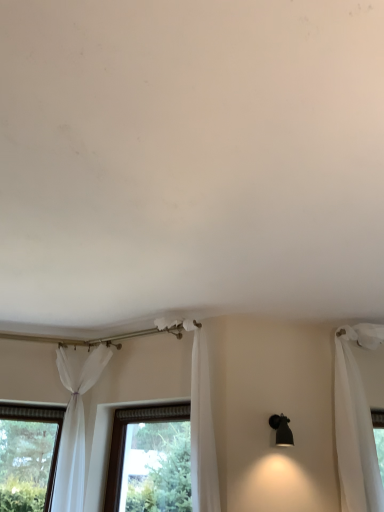
What is the approximate width of sheer white curtain at lower left, which appears as the first curtain when viewed from the left?

sheer white curtain at lower left, which appears as the first curtain when viewed from the left, is 54.36 centimeters wide.

At what (x,y) coordinates should I click in order to perform the action: click on clear glass window at center. Please return your answer as a coordinate pair (x, y). The width and height of the screenshot is (384, 512). Looking at the image, I should click on (125, 439).

Can you see clear glass window at center touching black matte wall sconce at right?

No, clear glass window at center is not next to black matte wall sconce at right.

Is clear glass window at center surrounding black matte wall sconce at right?

That's incorrect, black matte wall sconce at right is not inside clear glass window at center.

Does clear glass window at center have a lesser height compared to black matte wall sconce at right?

In fact, clear glass window at center may be taller than black matte wall sconce at right.

Which is behind, point (120, 431) or point (289, 443)?

The point (120, 431) is more distant.

Who is taller, black matte wall sconce at right or sheer white curtain at lower left, which appears as the first curtain when viewed from the left?

sheer white curtain at lower left, which appears as the first curtain when viewed from the left.

In the scene shown: Between black matte wall sconce at right and sheer white curtain at lower left, arranged as the 2th curtain when viewed from the right, which one is positioned in front?

black matte wall sconce at right is more forward.

Considering the positions of point (287, 424) and point (86, 361), is point (287, 424) closer or farther from the camera than point (86, 361)?

Clearly, point (287, 424) is closer to the camera than point (86, 361).

From the image's perspective, which object appears higher, black matte wall sconce at right or sheer white curtain at lower left, which appears as the first curtain when viewed from the left?

black matte wall sconce at right is shown above in the image.

Is white sheer curtain at center, positioned as the 1th curtain in right-to-left order, further to camera compared to clear glass window at center?

No.

Between white sheer curtain at center, which is counted as the 2th curtain, starting from the left, and clear glass window at center, which one has smaller width?

With smaller width is clear glass window at center.

Could you tell me if white sheer curtain at center, positioned as the 1th curtain in right-to-left order, is turned towards clear glass window at center?

No, white sheer curtain at center, positioned as the 1th curtain in right-to-left order, is not aimed at clear glass window at center.

From a real-world perspective, who is located higher, white sheer curtain at center, positioned as the 1th curtain in right-to-left order, or clear glass window at center?

From a 3D spatial view, white sheer curtain at center, positioned as the 1th curtain in right-to-left order, is above.

Consider the image. Considering the sizes of clear glass window at center and white sheer curtain at center, positioned as the 1th curtain in right-to-left order, in the image, is clear glass window at center bigger or smaller than white sheer curtain at center, positioned as the 1th curtain in right-to-left order,?

clear glass window at center is smaller than white sheer curtain at center, positioned as the 1th curtain in right-to-left order.

Which is correct: clear glass window at center is inside white sheer curtain at center, positioned as the 1th curtain in right-to-left order, or outside of it?

clear glass window at center is not inside white sheer curtain at center, positioned as the 1th curtain in right-to-left order, it's outside.

Can you tell me how much clear glass window at center and white sheer curtain at center, positioned as the 1th curtain in right-to-left order, differ in facing direction?

There is a 0.000783-degree angle between the facing directions of clear glass window at center and white sheer curtain at center, positioned as the 1th curtain in right-to-left order.

Could you tell me if clear glass window at center is turned towards white sheer curtain at center, which is counted as the 2th curtain, starting from the left?

Yes, clear glass window at center is oriented towards white sheer curtain at center, which is counted as the 2th curtain, starting from the left.

Is black matte wall sconce at right inside the boundaries of white sheer curtain at center, which is counted as the 2th curtain, starting from the left, or outside?

black matte wall sconce at right is not inside white sheer curtain at center, which is counted as the 2th curtain, starting from the left, it's outside.

From the image's perspective, is black matte wall sconce at right beneath white sheer curtain at center, positioned as the 1th curtain in right-to-left order?

Correct, black matte wall sconce at right appears lower than white sheer curtain at center, positioned as the 1th curtain in right-to-left order, in the image.

What's the angular difference between black matte wall sconce at right and white sheer curtain at center, positioned as the 1th curtain in right-to-left order,'s facing directions?

The angular difference between black matte wall sconce at right and white sheer curtain at center, positioned as the 1th curtain in right-to-left order, is 44.6 degrees.

Which is in front, black matte wall sconce at right or white sheer curtain at center, which is counted as the 2th curtain, starting from the left?

white sheer curtain at center, which is counted as the 2th curtain, starting from the left, is closer to the camera.

Can you confirm if black matte wall sconce at right is smaller than clear glass window at center?

Yes.

Is black matte wall sconce at right touching clear glass window at center?

No, black matte wall sconce at right is not in contact with clear glass window at center.

At what (x,y) coordinates should I click in order to perform the action: click on window on the left of black matte wall sconce at right. Please return your answer as a coordinate pair (x, y). Looking at the image, I should click on (125, 439).

From the image's perspective, is white sheer curtain at center, which is counted as the 2th curtain, starting from the left, located above or below black matte wall sconce at right?

white sheer curtain at center, which is counted as the 2th curtain, starting from the left, is situated higher than black matte wall sconce at right in the image.

Is black matte wall sconce at right at the back of white sheer curtain at center, positioned as the 1th curtain in right-to-left order?

No, black matte wall sconce at right is not at the back of white sheer curtain at center, positioned as the 1th curtain in right-to-left order.

Could black matte wall sconce at right be considered to be inside white sheer curtain at center, positioned as the 1th curtain in right-to-left order?

No, black matte wall sconce at right is not surrounded by white sheer curtain at center, positioned as the 1th curtain in right-to-left order.

Who is smaller, white sheer curtain at center, positioned as the 1th curtain in right-to-left order, or black matte wall sconce at right?

Smaller between the two is black matte wall sconce at right.

Find the location of a particular element. window below the black matte wall sconce at right (from a real-world perspective) is located at coordinates (125, 439).

Find the location of a particular element. curtain located behind the black matte wall sconce at right is located at coordinates (75, 423).

Based on their spatial positions, is black matte wall sconce at right or sheer white curtain at lower left, which appears as the first curtain when viewed from the left, closer to clear glass window at center?

sheer white curtain at lower left, which appears as the first curtain when viewed from the left, is positioned closer to the anchor clear glass window at center.

From the image, which object appears to be nearer to sheer white curtain at lower left, arranged as the 2th curtain when viewed from the right, black matte wall sconce at right or clear glass window at center?

Among the two, clear glass window at center is located nearer to sheer white curtain at lower left, arranged as the 2th curtain when viewed from the right.

When comparing their distances from white sheer curtain at center, positioned as the 1th curtain in right-to-left order, does sheer white curtain at lower left, which appears as the first curtain when viewed from the left, or clear glass window at center seem further?

sheer white curtain at lower left, which appears as the first curtain when viewed from the left, is positioned further to the anchor white sheer curtain at center, positioned as the 1th curtain in right-to-left order.

Considering their positions, is sheer white curtain at lower left, which appears as the first curtain when viewed from the left, positioned closer to black matte wall sconce at right than clear glass window at center?

clear glass window at center is closer to black matte wall sconce at right.

From the image, which object appears to be farther from black matte wall sconce at right, white sheer curtain at center, positioned as the 1th curtain in right-to-left order, or sheer white curtain at lower left, which appears as the first curtain when viewed from the left?

sheer white curtain at lower left, which appears as the first curtain when viewed from the left, is further to black matte wall sconce at right.

When comparing their distances from clear glass window at center, does white sheer curtain at center, positioned as the 1th curtain in right-to-left order, or sheer white curtain at lower left, arranged as the 2th curtain when viewed from the right, seem closer?

sheer white curtain at lower left, arranged as the 2th curtain when viewed from the right, is positioned closer to the anchor clear glass window at center.

Based on their spatial positions, is clear glass window at center or sheer white curtain at lower left, which appears as the first curtain when viewed from the left, closer to white sheer curtain at center, positioned as the 1th curtain in right-to-left order?

Based on the image, clear glass window at center appears to be nearer to white sheer curtain at center, positioned as the 1th curtain in right-to-left order.

Based on the photo, which object lies nearer to the anchor point clear glass window at center, black matte wall sconce at right or white sheer curtain at center, which is counted as the 2th curtain, starting from the left?

white sheer curtain at center, which is counted as the 2th curtain, starting from the left, is positioned closer to the anchor clear glass window at center.

Find the location of a particular element. This screenshot has width=384, height=512. curtain situated between clear glass window at center and black matte wall sconce at right from left to right is located at coordinates (200, 421).

The width and height of the screenshot is (384, 512). I want to click on window between sheer white curtain at lower left, which appears as the first curtain when viewed from the left, and black matte wall sconce at right, in the horizontal direction, so click(125, 439).

Image resolution: width=384 pixels, height=512 pixels. I want to click on window between sheer white curtain at lower left, which appears as the first curtain when viewed from the left, and white sheer curtain at center, which is counted as the 2th curtain, starting from the left, in the horizontal direction, so click(125, 439).

Where is `curtain located between sheer white curtain at lower left, which appears as the first curtain when viewed from the left, and black matte wall sconce at right in the left-right direction`? The height and width of the screenshot is (512, 384). curtain located between sheer white curtain at lower left, which appears as the first curtain when viewed from the left, and black matte wall sconce at right in the left-right direction is located at coordinates (200, 421).